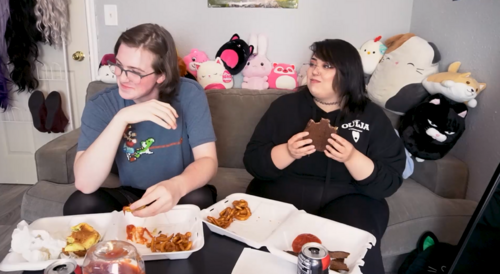
Find the location of a particular element. The height and width of the screenshot is (274, 500). floor is located at coordinates (12, 192).